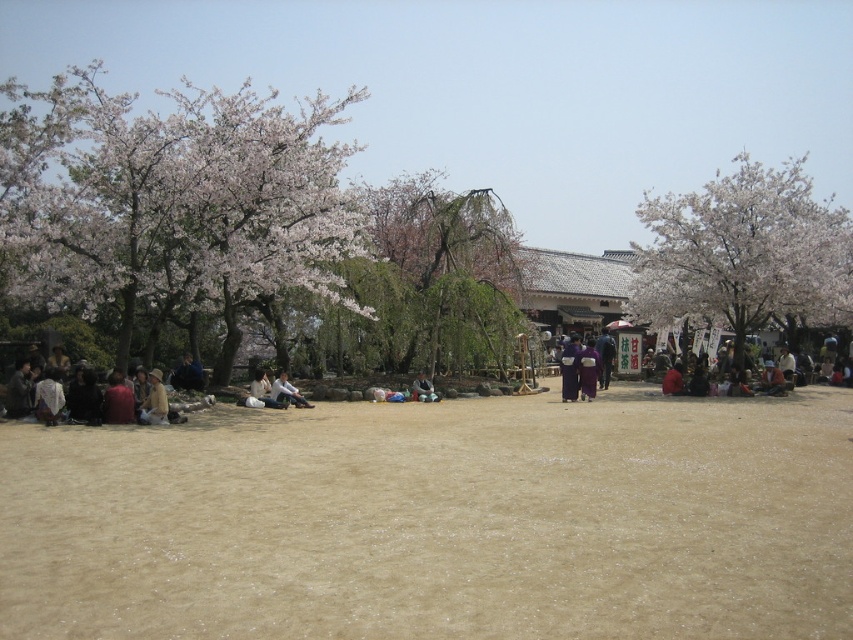
You are a photographer standing at the center of the scene, aiming to capture a photo that includes both the white blossoming tree at right and the matte brown jacket at lower left. Which object should you adjust your camera focus on first to ensure it appears clearer in the photo?

The white blossoming tree at right is further to the viewer than the matte brown jacket at lower left, so you should focus on the white blossoming tree at right first to ensure it appears clearer in the photo.

You are standing at the point marked by the coordinates point (744, 252) in the image. Looking around, what object are you directly facing?

The point (744, 252) corresponds to the white blossoming tree at right, so you are directly facing the white blossoming tree at right.